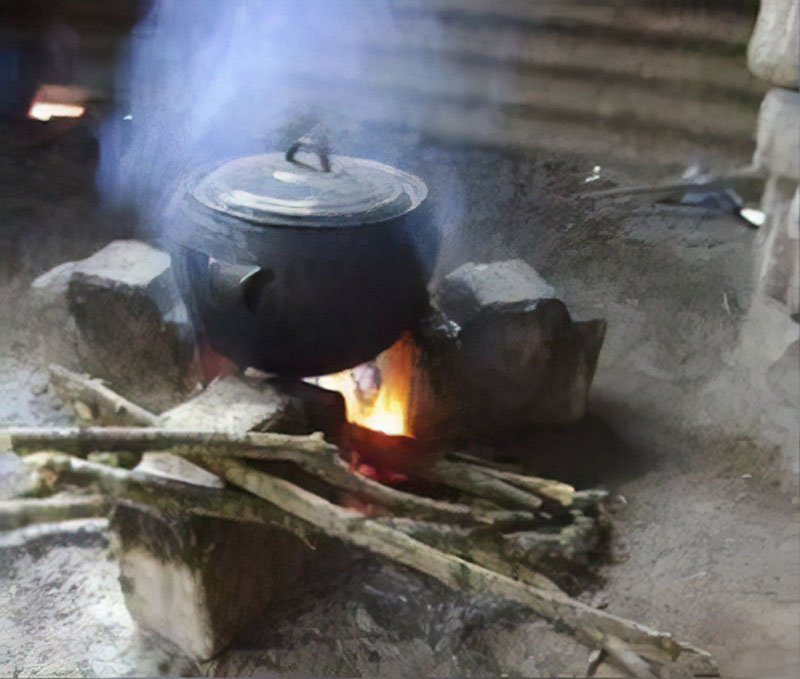
Image resolution: width=800 pixels, height=679 pixels. I want to click on handle for pot, so click(x=246, y=285).